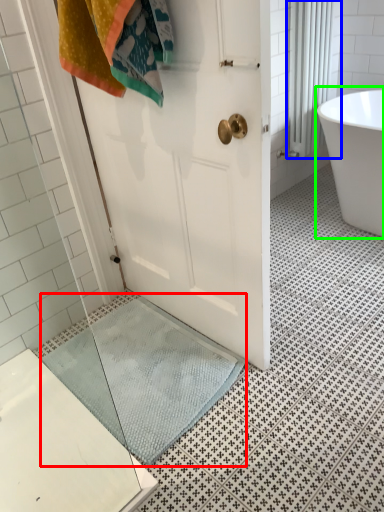
Question: Which object is positioned farthest from bath mat (highlighted by a red box)? Select from shower curtain (highlighted by a blue box) and bathtub (highlighted by a green box).

Choices:
 (A) shower curtain
 (B) bathtub

Answer: (A)